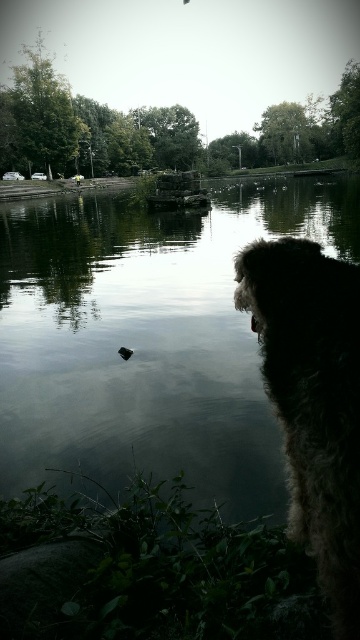
Question: Which object appears farthest from the camera in this image?

Choices:
 (A) fuzzy brown dog at right
 (B) smooth reflective water at center

Answer: (B)

Question: Does smooth reflective water at center appear over fuzzy brown dog at right?

Choices:
 (A) yes
 (B) no

Answer: (A)

Question: Among these objects, which one is farthest from the camera?

Choices:
 (A) fuzzy brown dog at right
 (B) smooth reflective water at center

Answer: (B)

Question: Is smooth reflective water at center positioned behind fuzzy brown dog at right?

Choices:
 (A) yes
 (B) no

Answer: (A)

Question: Among these objects, which one is farthest from the camera?

Choices:
 (A) fuzzy brown dog at right
 (B) smooth reflective water at center

Answer: (B)

Question: Does smooth reflective water at center have a larger size compared to fuzzy brown dog at right?

Choices:
 (A) no
 (B) yes

Answer: (B)